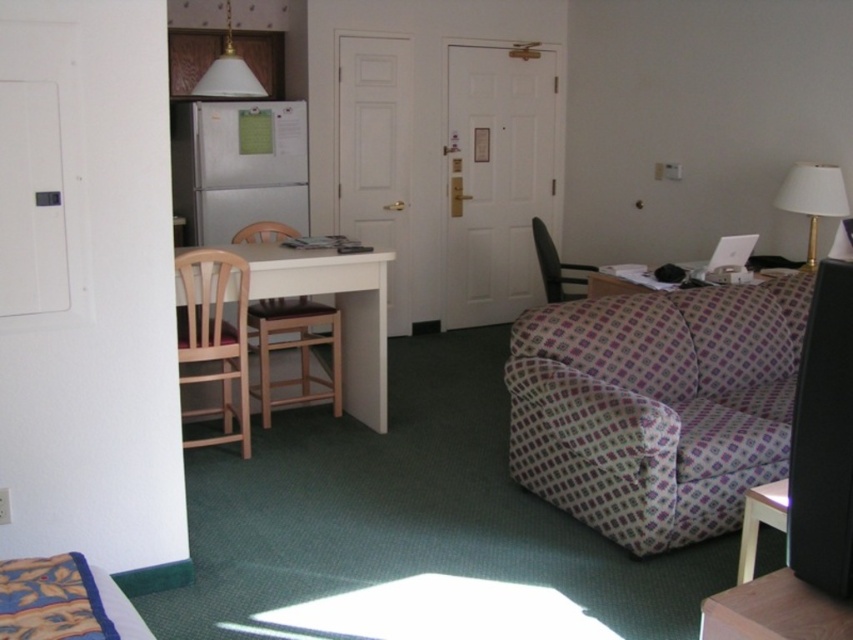
Who is taller, white wood table at center or brown wood chair at left?

white wood table at center is taller.

Image resolution: width=853 pixels, height=640 pixels. In order to click on white wood table at center in this screenshot , I will do `click(338, 308)`.

Who is more forward, (366, 300) or (653, 282)?

Point (366, 300) is in front.

Which is below, white wood table at center or plaid fabric couch at right?

white wood table at center is below.

Does point (305, 253) come behind point (596, 296)?

No, it is in front of (596, 296).

The width and height of the screenshot is (853, 640). Find the location of `white wood table at center`. white wood table at center is located at coordinates (338, 308).

Does light brown wood chair at left appear under wooden table at lower right?

No.

Measure the distance between point (231, 372) and camera.

12.38 feet

Locate an element on the screen. Image resolution: width=853 pixels, height=640 pixels. light brown wood chair at left is located at coordinates (215, 337).